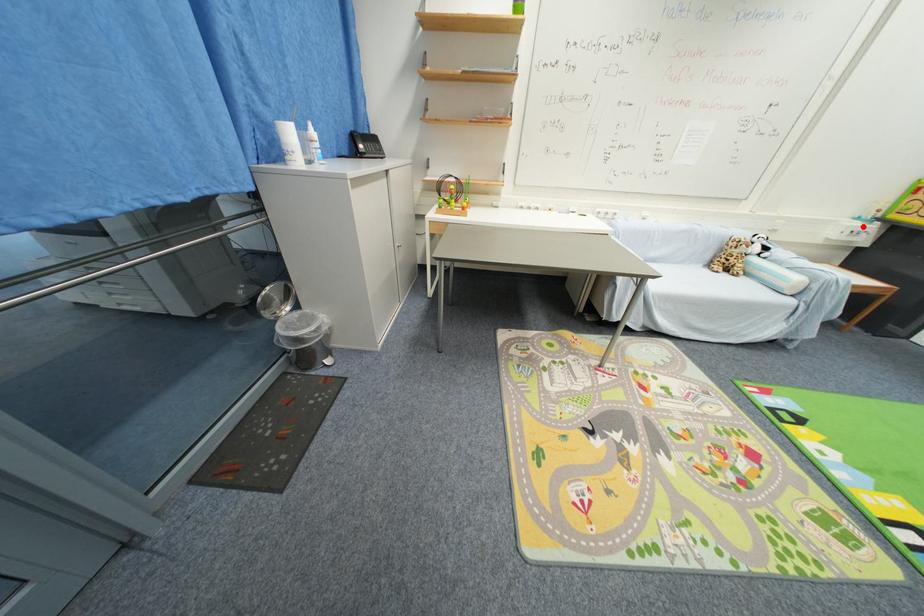
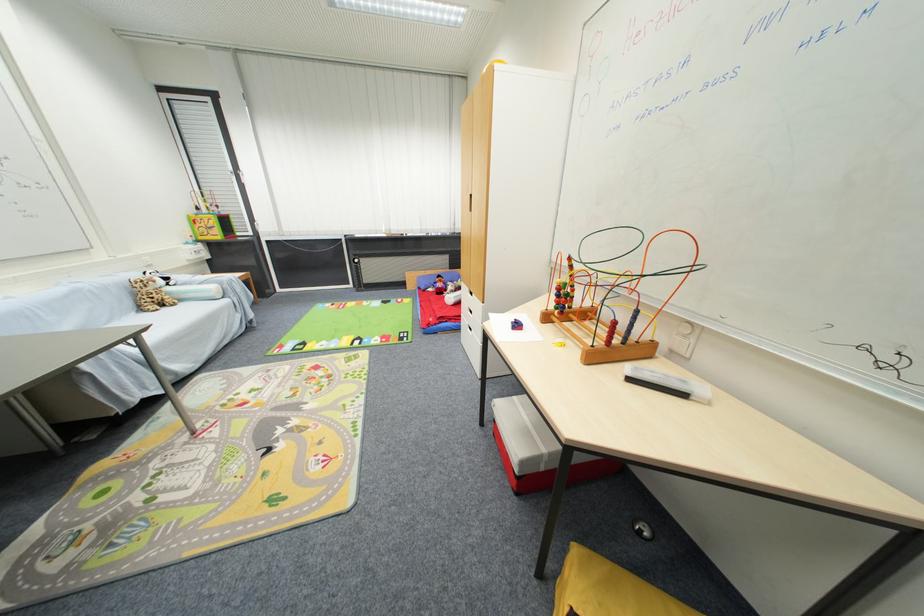
In the second image, find the point that corresponds to the highlighted location in the first image.

(198, 249)